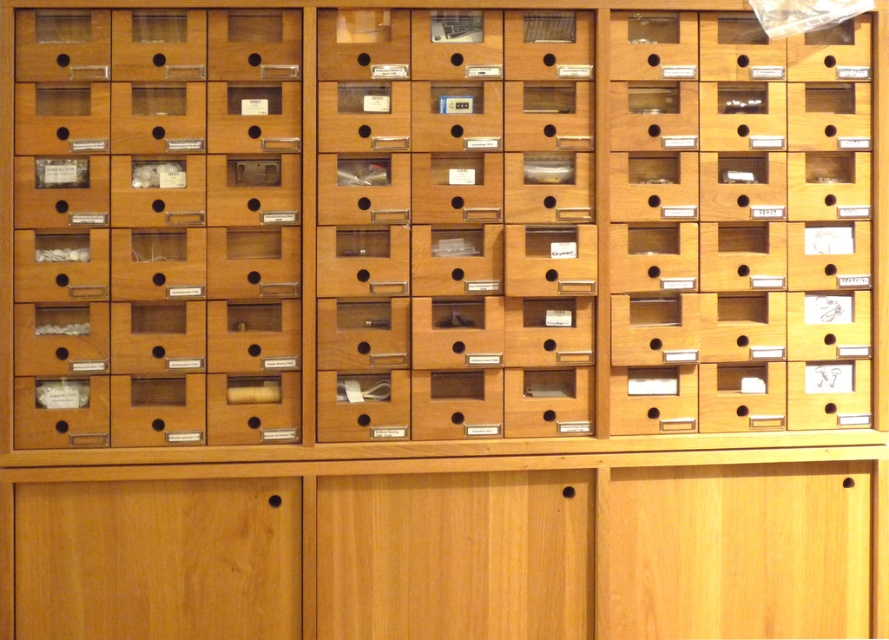
You are organizing a collection of small items and need to determine which drawer to use. The wooden drawer at left and the wooden drawer at center are available. Which drawer has more space for larger items?

The wooden drawer at center has more space because it occupies more space than the wooden drawer at left.

You are standing in front of the wooden storage unit and want to reach both the point at (637, 344) and the point at (486, 397). Which point will you need to reach first if you start from the front?

You will need to reach point (486, 397) first because it is closer to you than point (637, 344), which is further away.

You are organizing items in the wooden storage unit. You need to place a taller item in the higher drawer. Which drawer should you choose between the wooden drawer at left and the wooden drawer at center?

You should choose the wooden drawer at center because it is higher than the wooden drawer at left.